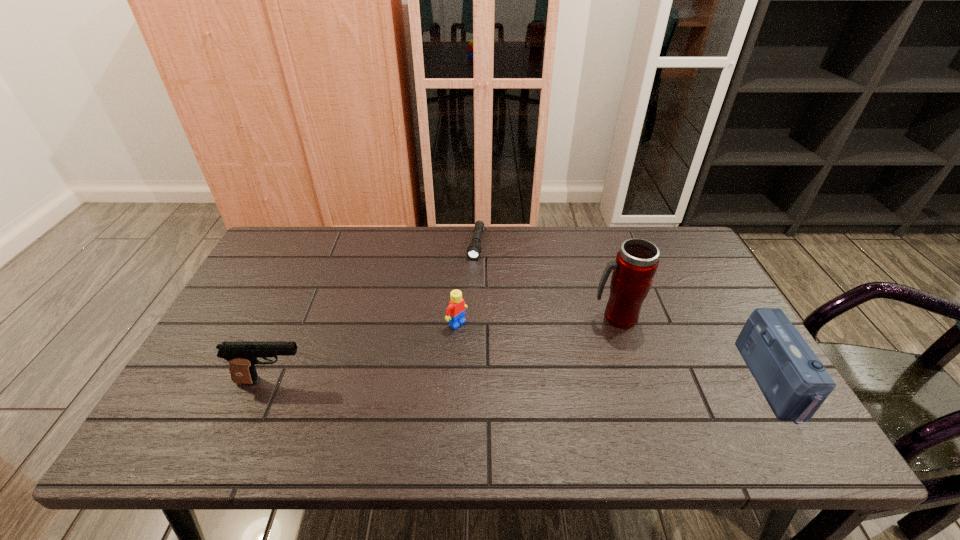
Locate an element on the screen. Image resolution: width=960 pixels, height=540 pixels. free space on the desktop that is between the leftmost object and the camera and is positioned at the lens end of the farthest object is located at coordinates (447, 381).

Locate an element on the screen. This screenshot has height=540, width=960. vacant space on the desktop that is between the leftmost object and the rightmost object and is positioned on the face of the Lego is located at coordinates (535, 381).

Locate an element on the screen. vacant space on the desktop that is between the pistol and the camera and is positioned on the side with the handle of the tallest object is located at coordinates (539, 381).